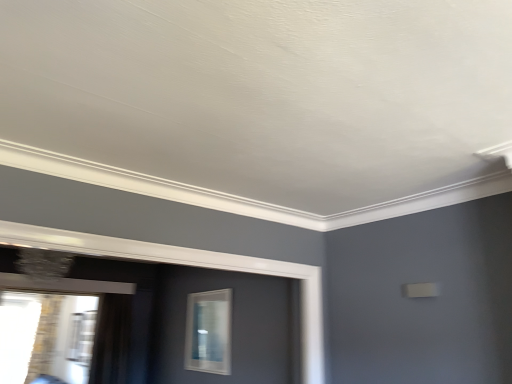
In order to face clear glass window at center, which appears as the 1th window when viewed from the right, should I rotate leftwards or rightwards?

To face it directly, rotate left by 6.673 degrees.

This screenshot has width=512, height=384. Identify the location of black sheer curtain at left. (112, 340).

Between point (66, 306) and point (103, 311), which one is positioned behind?

Point (66, 306)

There is a black sheer curtain at left. In order to click on the 1st window above it (from a real-world perspective) in this screenshot , I will do `click(52, 327)`.

Which is more to the left, transparent glass window at lower left, which appears as the 2th window when viewed from the right, or black sheer curtain at left?

From the viewer's perspective, transparent glass window at lower left, which appears as the 2th window when viewed from the right, appears more on the left side.

Is transparent glass window at lower left, which appears as the 2th window when viewed from the right, not within black sheer curtain at left?

transparent glass window at lower left, which appears as the 2th window when viewed from the right, lies outside black sheer curtain at left's area.

Are clear glass window at center, which appears as the 1th window when viewed from the right, and transparent glass window at lower left, which appears as the 2th window when viewed from the right, beside each other?

No, clear glass window at center, which appears as the 1th window when viewed from the right, is not beside transparent glass window at lower left, which appears as the 2th window when viewed from the right.

Is clear glass window at center, the 2th window from the left, at the right side of transparent glass window at lower left, which appears as the 2th window when viewed from the right?

Correct, you'll find clear glass window at center, the 2th window from the left, to the right of transparent glass window at lower left, which appears as the 2th window when viewed from the right.

From the picture: From a real-world perspective, between clear glass window at center, which appears as the 1th window when viewed from the right, and transparent glass window at lower left, which is the first window in left-to-right order, who is vertically higher?

clear glass window at center, which appears as the 1th window when viewed from the right, is physically above.

Considering the relative sizes of clear glass window at center, which appears as the 1th window when viewed from the right, and transparent glass window at lower left, which appears as the 2th window when viewed from the right, in the image provided, is clear glass window at center, which appears as the 1th window when viewed from the right, bigger than transparent glass window at lower left, which appears as the 2th window when viewed from the right,?

Actually, clear glass window at center, which appears as the 1th window when viewed from the right, might be smaller than transparent glass window at lower left, which appears as the 2th window when viewed from the right.

Considering the positions of objects clear glass window at center, which appears as the 1th window when viewed from the right, and black sheer curtain at left in the image provided, who is more to the right, clear glass window at center, which appears as the 1th window when viewed from the right, or black sheer curtain at left?

clear glass window at center, which appears as the 1th window when viewed from the right.

Based on the photo, from the image's perspective, is clear glass window at center, the 2th window from the left, positioned above or below black sheer curtain at left?

Clearly, from the image's perspective, clear glass window at center, the 2th window from the left, is above black sheer curtain at left.

Does clear glass window at center, the 2th window from the left, have a greater width compared to black sheer curtain at left?

Incorrect, the width of clear glass window at center, the 2th window from the left, does not surpass that of black sheer curtain at left.

Is clear glass window at center, the 2th window from the left, bigger or smaller than black sheer curtain at left?

In the image, clear glass window at center, the 2th window from the left, appears to be smaller than black sheer curtain at left.

Would you say black sheer curtain at left is inside or outside clear glass window at center, which appears as the 1th window when viewed from the right?

black sheer curtain at left is located beyond the bounds of clear glass window at center, which appears as the 1th window when viewed from the right.

In terms of height, does black sheer curtain at left look taller or shorter compared to clear glass window at center, the 2th window from the left?

black sheer curtain at left is taller than clear glass window at center, the 2th window from the left.

Between black sheer curtain at left and clear glass window at center, which appears as the 1th window when viewed from the right, which one has smaller size?

With smaller size is clear glass window at center, which appears as the 1th window when viewed from the right.

Is black sheer curtain at left taller than transparent glass window at lower left, which appears as the 2th window when viewed from the right?

Incorrect, the height of black sheer curtain at left is not larger of that of transparent glass window at lower left, which appears as the 2th window when viewed from the right.

Based on the photo, is black sheer curtain at left facing away from transparent glass window at lower left, which is the first window in left-to-right order?

That's not correct — black sheer curtain at left is not looking away from transparent glass window at lower left, which is the first window in left-to-right order.

In the image, there is a transparent glass window at lower left, which appears as the 2th window when viewed from the right. What are the coordinates of `curtain below it (from the image's perspective)` in the screenshot? It's located at (112, 340).

Is black sheer curtain at left outside of transparent glass window at lower left, which is the first window in left-to-right order?

Yes, black sheer curtain at left is outside of transparent glass window at lower left, which is the first window in left-to-right order.

Is transparent glass window at lower left, which appears as the 2th window when viewed from the right, far from clear glass window at center, the 2th window from the left?

transparent glass window at lower left, which appears as the 2th window when viewed from the right, is positioned a significant distance from clear glass window at center, the 2th window from the left.

Is transparent glass window at lower left, which is the first window in left-to-right order, not inside clear glass window at center, the 2th window from the left?

transparent glass window at lower left, which is the first window in left-to-right order, is positioned outside clear glass window at center, the 2th window from the left.

Does transparent glass window at lower left, which appears as the 2th window when viewed from the right, turn towards clear glass window at center, which appears as the 1th window when viewed from the right?

Yes, transparent glass window at lower left, which appears as the 2th window when viewed from the right, is facing clear glass window at center, which appears as the 1th window when viewed from the right.

In order to click on curtain that is behind the transparent glass window at lower left, which is the first window in left-to-right order in this screenshot , I will do `click(112, 340)`.

Where is `window above the transparent glass window at lower left, which appears as the 2th window when viewed from the right (from a real-world perspective)`? The width and height of the screenshot is (512, 384). window above the transparent glass window at lower left, which appears as the 2th window when viewed from the right (from a real-world perspective) is located at coordinates (209, 332).

Estimate the real-world distances between objects in this image. Which object is further from transparent glass window at lower left, which appears as the 2th window when viewed from the right, black sheer curtain at left or clear glass window at center, the 2th window from the left?

clear glass window at center, the 2th window from the left, is further to transparent glass window at lower left, which appears as the 2th window when viewed from the right.

From the image, which object appears to be farther from clear glass window at center, which appears as the 1th window when viewed from the right, black sheer curtain at left or transparent glass window at lower left, which appears as the 2th window when viewed from the right?

transparent glass window at lower left, which appears as the 2th window when viewed from the right, is positioned further to the anchor clear glass window at center, which appears as the 1th window when viewed from the right.

From the image, which object appears to be nearer to clear glass window at center, the 2th window from the left, transparent glass window at lower left, which is the first window in left-to-right order, or black sheer curtain at left?

Based on the image, black sheer curtain at left appears to be nearer to clear glass window at center, the 2th window from the left.

Estimate the real-world distances between objects in this image. Which object is closer to transparent glass window at lower left, which is the first window in left-to-right order, clear glass window at center, which appears as the 1th window when viewed from the right, or black sheer curtain at left?

Based on the image, black sheer curtain at left appears to be nearer to transparent glass window at lower left, which is the first window in left-to-right order.

Estimate the real-world distances between objects in this image. Which object is further from black sheer curtain at left, clear glass window at center, the 2th window from the left, or transparent glass window at lower left, which appears as the 2th window when viewed from the right?

clear glass window at center, the 2th window from the left, is further to black sheer curtain at left.

From the image, which object appears to be farther from black sheer curtain at left, transparent glass window at lower left, which appears as the 2th window when viewed from the right, or clear glass window at center, which appears as the 1th window when viewed from the right?

Among the two, clear glass window at center, which appears as the 1th window when viewed from the right, is located further to black sheer curtain at left.

You are a GUI agent. You are given a task and a screenshot of the screen. Output one action in this format:
    pyautogui.click(x=<x>, y=<y>)
    Task: Click on the curtain between transparent glass window at lower left, which appears as the 2th window when viewed from the right, and clear glass window at center, which appears as the 1th window when viewed from the right, in the horizontal direction
    This screenshot has width=512, height=384.
    Given the screenshot: What is the action you would take?
    pyautogui.click(x=112, y=340)